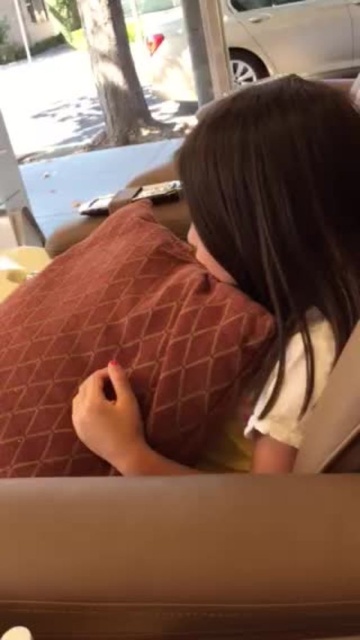
Question: Which point appears closest to the camera in this image?

Choices:
 (A) (295, 272)
 (B) (183, 45)

Answer: (A)

Question: Is matte brown pillow at center bigger than velvet-like brown pillow at center?

Choices:
 (A) yes
 (B) no

Answer: (B)

Question: Which is farther from the matte brown pillow at center?

Choices:
 (A) velvet-like brown pillow at center
 (B) silver metallic car at upper center

Answer: (B)

Question: Can you confirm if velvet-like brown pillow at center is thinner than silver metallic car at upper center?

Choices:
 (A) yes
 (B) no

Answer: (A)

Question: Is matte brown pillow at center below silver metallic car at upper center?

Choices:
 (A) yes
 (B) no

Answer: (A)

Question: Estimate the real-world distances between objects in this image. Which object is farther from the velvet-like brown pillow at center?

Choices:
 (A) matte brown pillow at center
 (B) silver metallic car at upper center

Answer: (B)